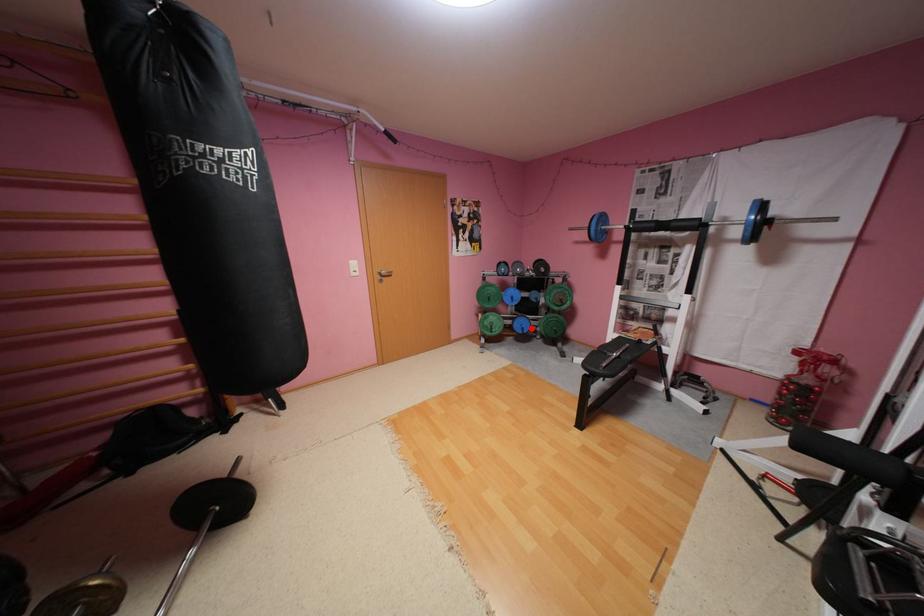
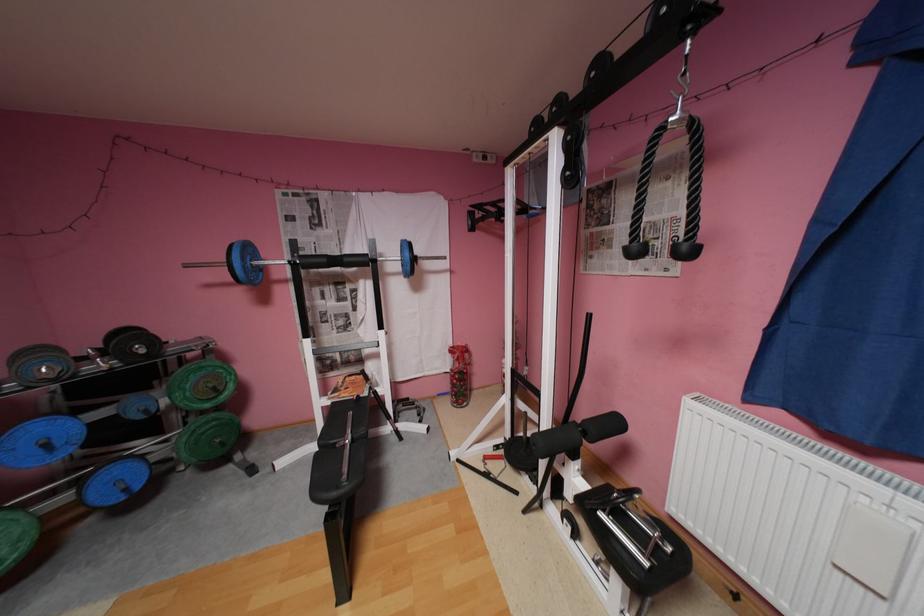
Question: I am providing you with two images of the same scene from different viewpoints. Image1 has a red point marked. In image2, the corresponding 3D location appears at what relative position? Reply with the corresponding letter.

Choices:
 (A) Closer
 (B) Farther

Answer: (A)